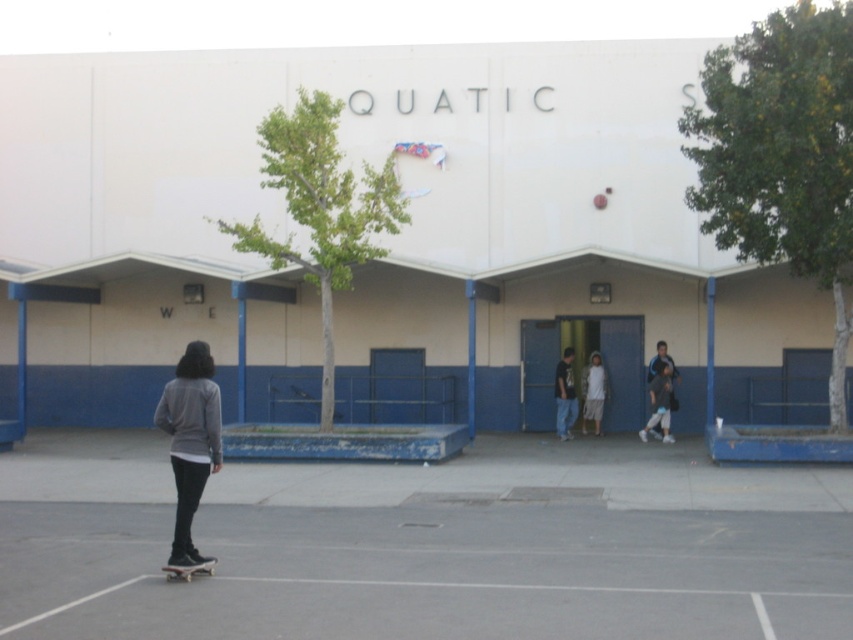
Question: From the image, what is the correct spatial relationship of gray sweatshirt at center in relation to dark blue jeans at center?

Choices:
 (A) left
 (B) right

Answer: (A)

Question: Considering the relative positions of gray sweatshirt at center and light blue jeans at center in the image provided, where is gray sweatshirt at center located with respect to light blue jeans at center?

Choices:
 (A) below
 (B) above

Answer: (A)

Question: Which of these objects is positioned closest to the black matte skateboard at lower left?

Choices:
 (A) white cotton shirt at center
 (B) light blue jeans at center

Answer: (B)

Question: Which of these objects is positioned closest to the dark blue jeans at center?

Choices:
 (A) black matte skateboard at lower left
 (B) light blue jeans at center

Answer: (B)

Question: Among these objects, which one is farthest from the camera?

Choices:
 (A) gray sweatshirt at center
 (B) black matte skateboard at lower left
 (C) white cotton shirt at center

Answer: (C)

Question: Is gray sweatshirt at center further to camera compared to black matte skateboard at lower left?

Choices:
 (A) yes
 (B) no

Answer: (A)